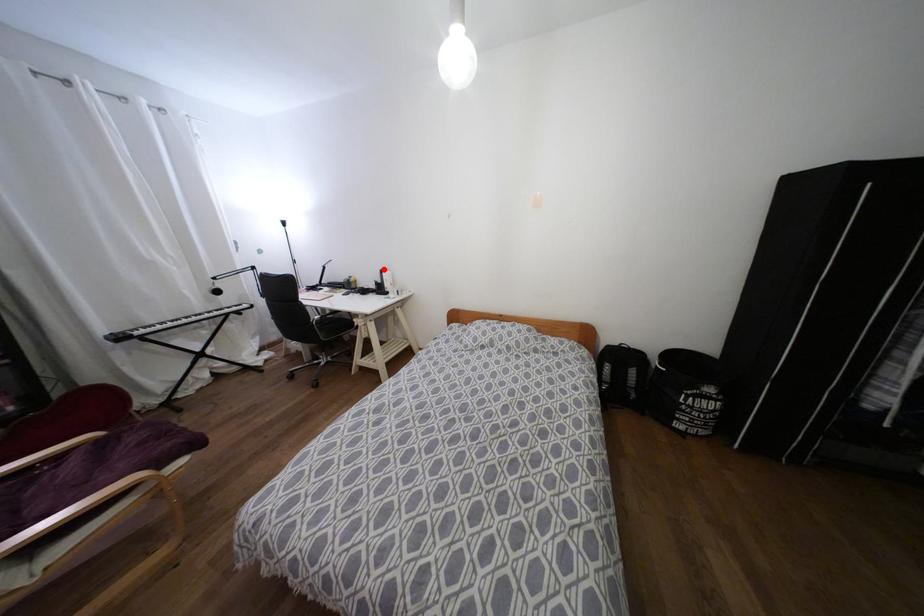
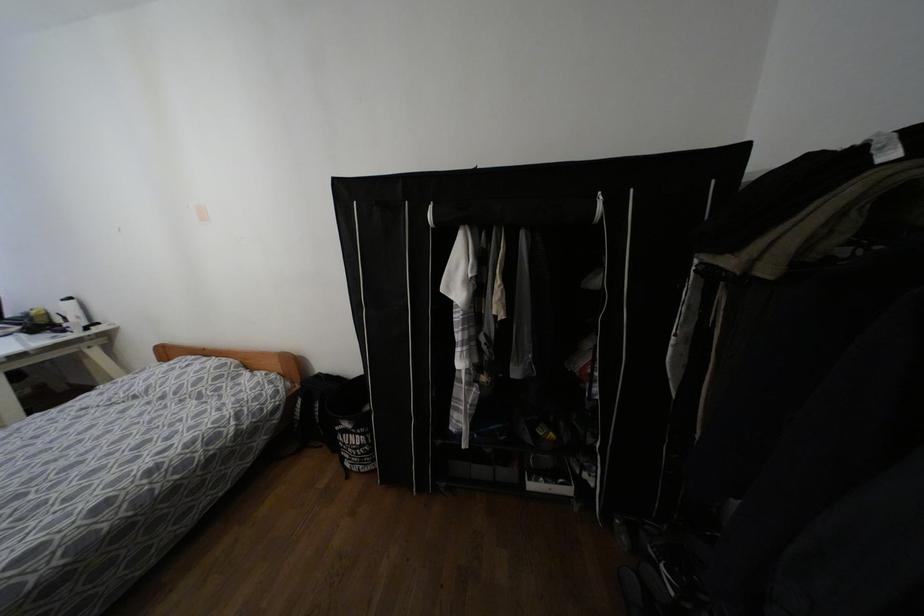
In the second image, find the point that corresponds to the highlighted location in the first image.

(68, 299)